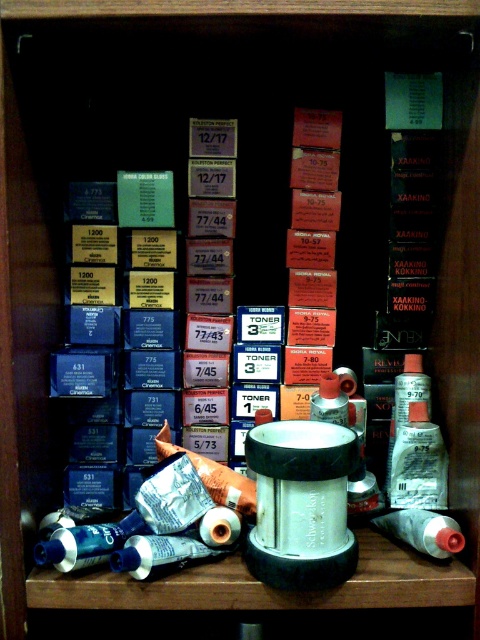
Does point (427, 522) come closer to viewer compared to point (324, 419)?

Yes.

The width and height of the screenshot is (480, 640). What are the coordinates of `white matte toilet paper at lower right` in the screenshot? It's located at (422, 531).

Between satin silver tube at lower right and translucent plastic bottle at center, which one has more height?

Standing taller between the two is satin silver tube at lower right.

Find the location of a particular element. The image size is (480, 640). satin silver tube at lower right is located at coordinates (418, 464).

Is satin silver tube at lower right taller than white matte toilet paper at lower right?

Indeed, satin silver tube at lower right has a greater height compared to white matte toilet paper at lower right.

Can you confirm if satin silver tube at lower right is shorter than white matte toilet paper at lower right?

In fact, satin silver tube at lower right may be taller than white matte toilet paper at lower right.

Locate an element on the screen. The image size is (480, 640). satin silver tube at lower right is located at coordinates (418, 464).